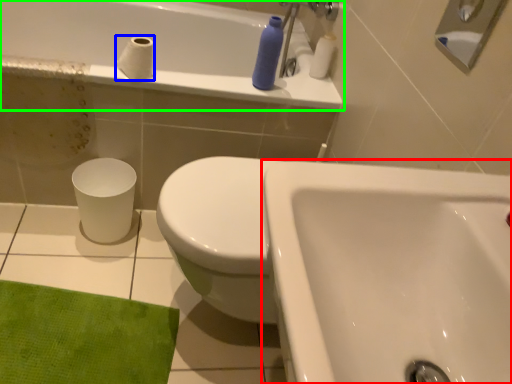
Question: Based on their relative distances, which object is farther from sink (highlighted by a red box)? Choose from toilet paper (highlighted by a blue box) and bathtub (highlighted by a green box).

Choices:
 (A) toilet paper
 (B) bathtub

Answer: (B)